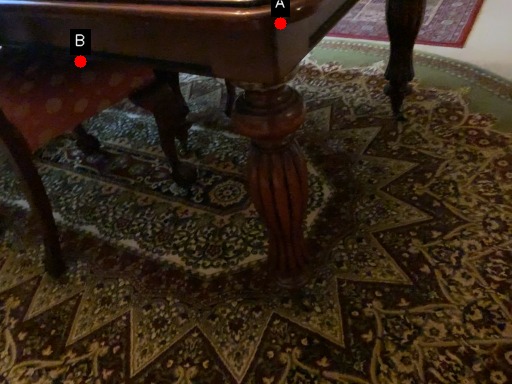
Question: Two points are circled on the image, labeled by A and B beside each circle. Which point appears closest to the camera in this image?

Choices:
 (A) A is closer
 (B) B is closer

Answer: (A)